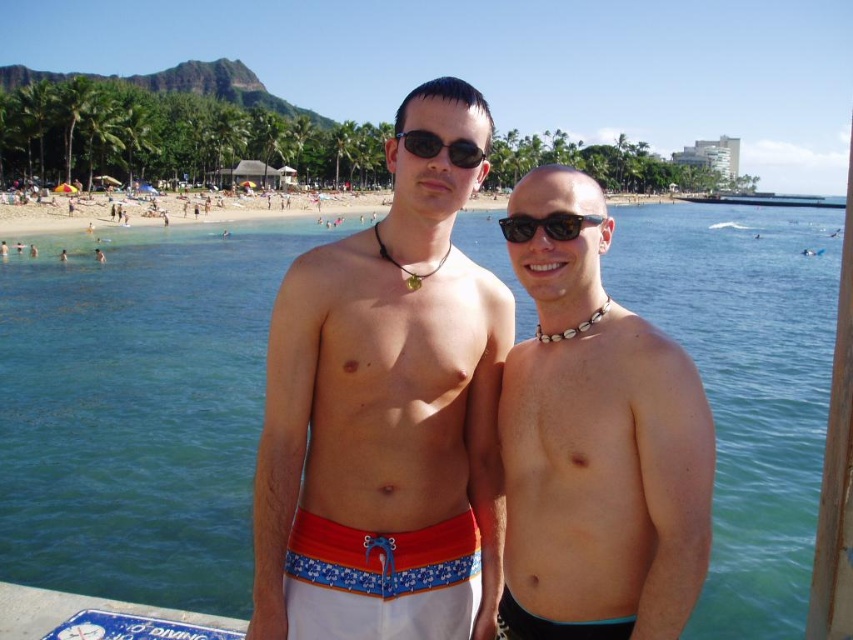
You are a photographer taking a photo of the brown leather necklace at center. What are the coordinates of the necklace in the image?

The coordinates of the brown leather necklace at center are at point [596,445].